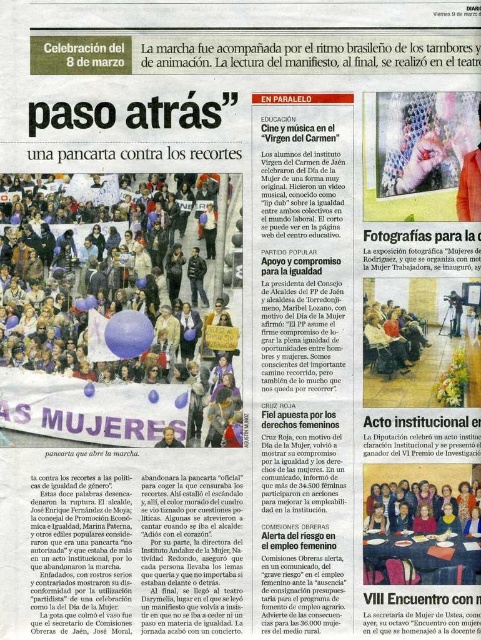
Question: Does matte black dress at center have a greater width compared to matte black camera at center?

Choices:
 (A) yes
 (B) no

Answer: (A)

Question: Which point is closer to the camera taking this photo?

Choices:
 (A) (89, 417)
 (B) (451, 326)
 (C) (363, 330)

Answer: (C)

Question: Where is matte brown wooden chair at center located in relation to matte black camera at center in the image?

Choices:
 (A) right
 (B) left

Answer: (B)

Question: Which is farther from the white paper banner at center?

Choices:
 (A) matte black dress at center
 (B) matte brown wooden chair at center

Answer: (A)

Question: Among these points, which one is farthest from the camera?

Choices:
 (A) (477, 173)
 (B) (459, 312)
 (C) (444, 509)
 (D) (87, 280)

Answer: (B)

Question: Does textured fabric scarf at upper center have a smaller size compared to matte black camera at center?

Choices:
 (A) yes
 (B) no

Answer: (B)